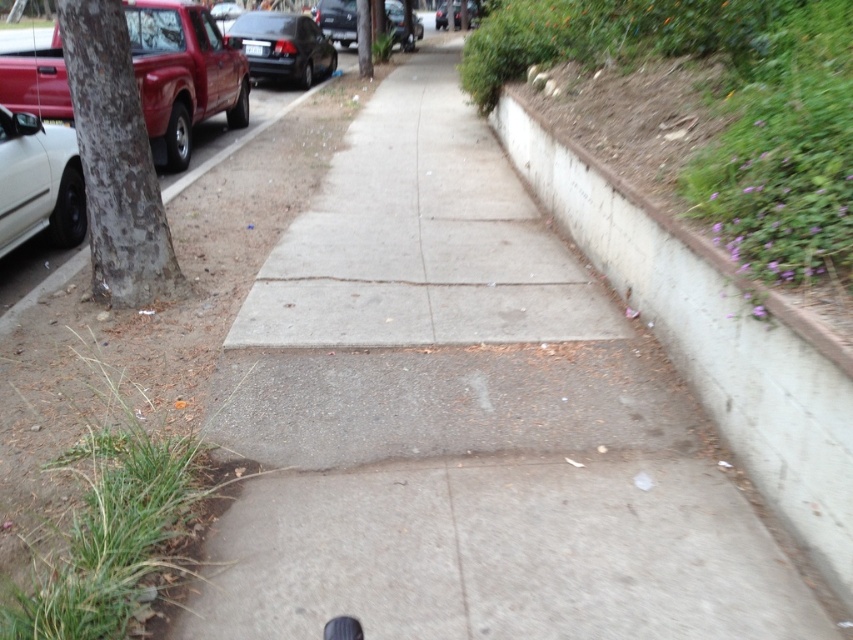
Question: Is concrete at right in front of matte black car at center?

Choices:
 (A) yes
 (B) no

Answer: (A)

Question: Which object is farther from the camera taking this photo?

Choices:
 (A) metallic gray car at upper center
 (B) concrete at right
 (C) white matte car at left

Answer: (A)

Question: Based on their relative distances, which object is nearer to the white matte car at left?

Choices:
 (A) metallic gray car at upper center
 (B) matte black car at center
 (C) matte red truck at left
 (D) concrete at right

Answer: (C)

Question: Which point is farther from the camera taking this photo?

Choices:
 (A) (74, 218)
 (B) (399, 16)
 (C) (257, 36)
 (D) (219, 70)

Answer: (B)

Question: Observing the image, what is the correct spatial positioning of matte black car at center in reference to black rubber shoe at lower center?

Choices:
 (A) below
 (B) above

Answer: (B)

Question: Does matte red truck at left appear on the right side of matte black car at center?

Choices:
 (A) no
 (B) yes

Answer: (A)